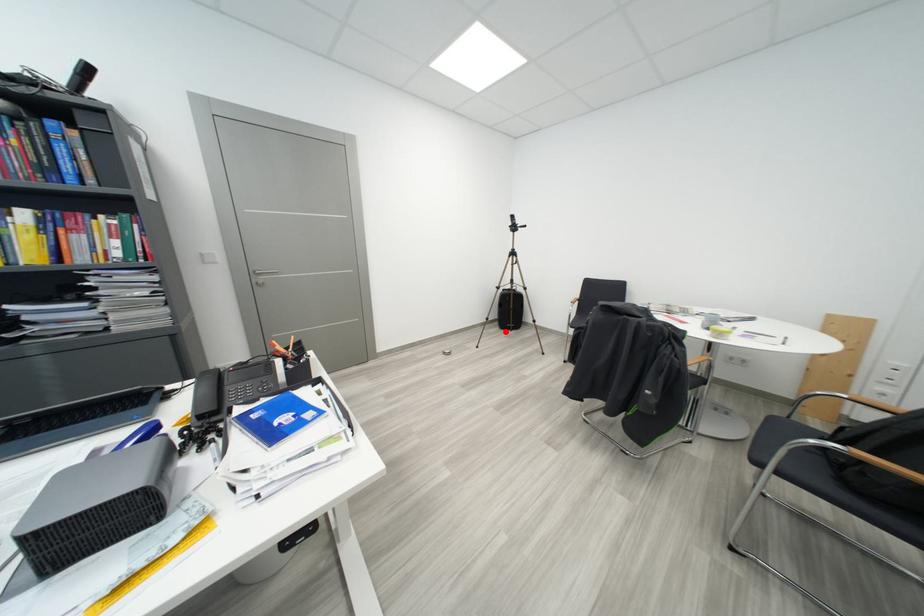
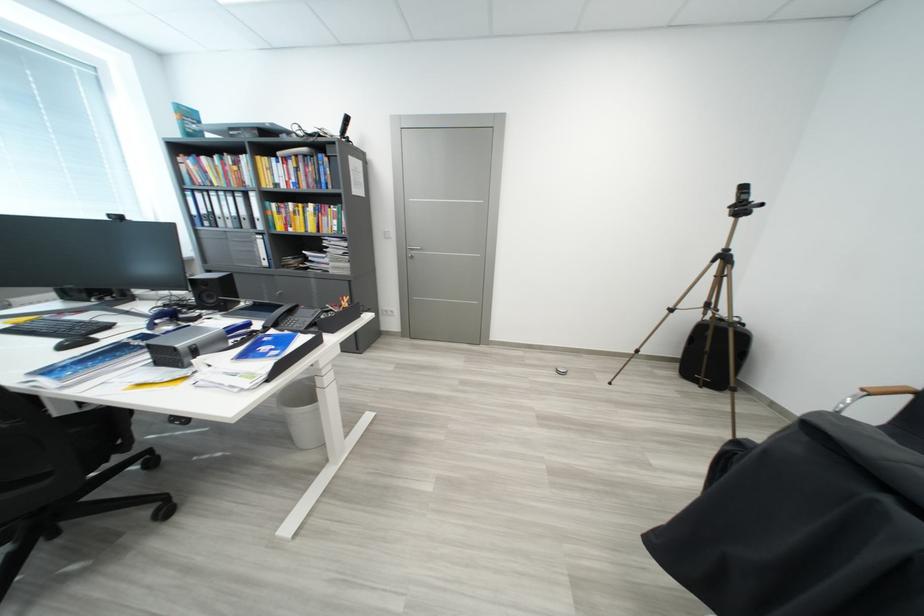
Locate, in the second image, the point that corresponds to the highlighted location in the first image.

(684, 377)